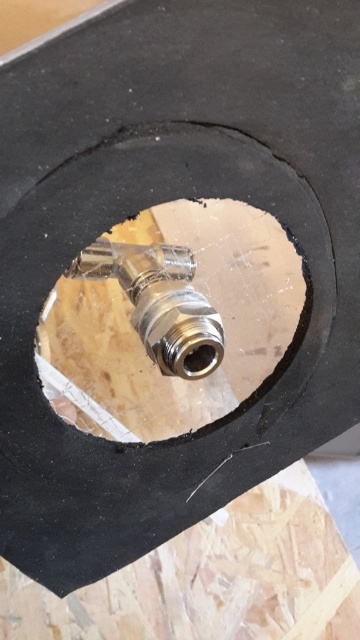
In the scene shown: Is metallic brass valve at center behind polished brass valve at center?

That is False.

Does metallic brass valve at center have a lesser height compared to polished brass valve at center?

In fact, metallic brass valve at center may be taller than polished brass valve at center.

Describe the element at coordinates (140, 340) in the screenshot. Image resolution: width=360 pixels, height=640 pixels. I see `metallic brass valve at center` at that location.

At what (x,y) coordinates should I click in order to perform the action: click on metallic brass valve at center. Please return your answer as a coordinate pair (x, y). Image resolution: width=360 pixels, height=640 pixels. Looking at the image, I should click on (140, 340).